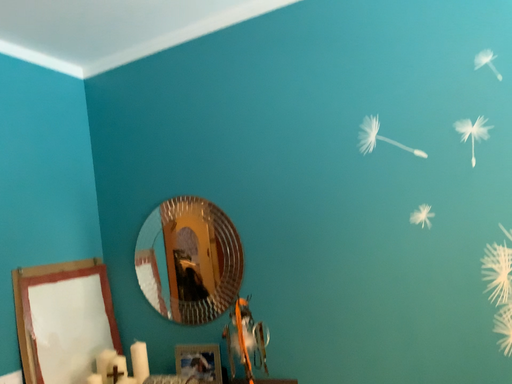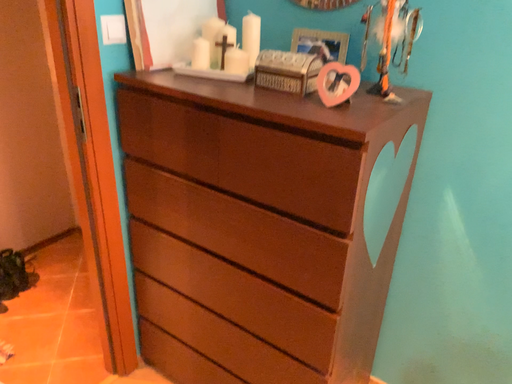
Question: How did the camera likely rotate when shooting the video?

Choices:
 (A) rotated upward
 (B) rotated downward

Answer: (B)